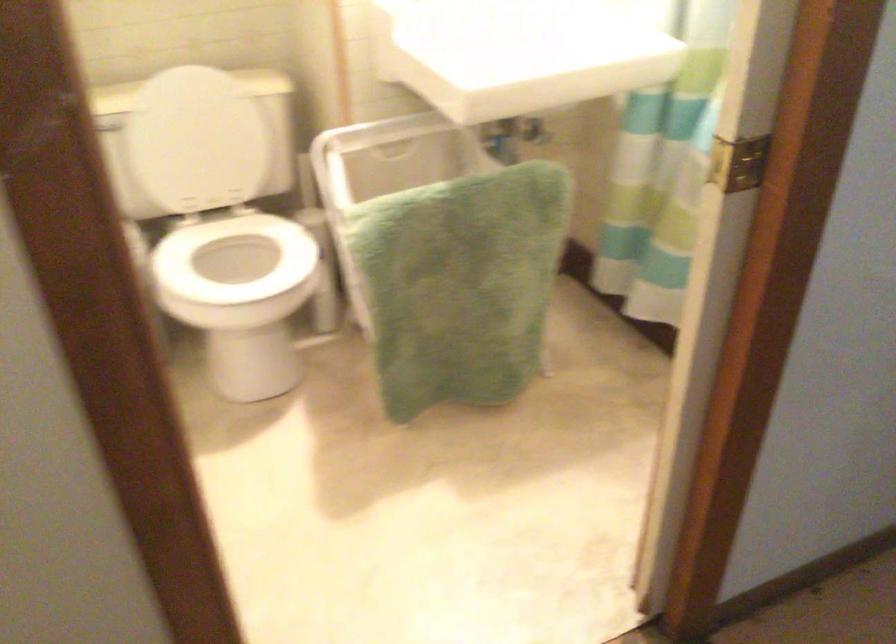
The images are taken continuously from a first-person perspective. In which direction is your viewpoint rotating?

The camera rotated toward right-down.